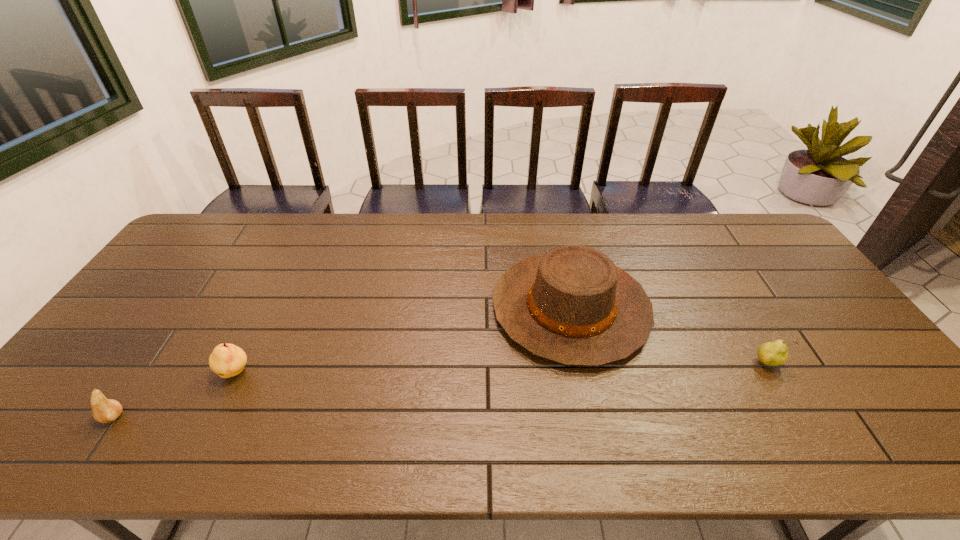
Where is `pear that stands as the closest to the rightmost pear`? The width and height of the screenshot is (960, 540). pear that stands as the closest to the rightmost pear is located at coordinates (227, 360).

Locate which pear is the closest to the rightmost pear. Please provide its 2D coordinates. Your answer should be formatted as a tuple, i.e. [(x, y)], where the tuple contains the x and y coordinates of a point satisfying the conditions above.

[(227, 360)]

The height and width of the screenshot is (540, 960). I want to click on free region that satisfies the following two spatial constraints: 1. on the back side of the rightmost pear; 2. on the left side of the nearest pear, so click(150, 363).

Image resolution: width=960 pixels, height=540 pixels. In order to click on free spot that satisfies the following two spatial constraints: 1. on the back side of the second object from left to right; 2. on the right side of the tallest object in this screenshot , I will do click(267, 308).

You are a GUI agent. You are given a task and a screenshot of the screen. Output one action in this format:
    pyautogui.click(x=<x>, y=<y>)
    Task: Click on the vacant space that satisfies the following two spatial constraints: 1. on the back side of the second pear from left to right; 2. on the left side of the leftmost object
    The image size is (960, 540).
    Given the screenshot: What is the action you would take?
    pyautogui.click(x=143, y=373)